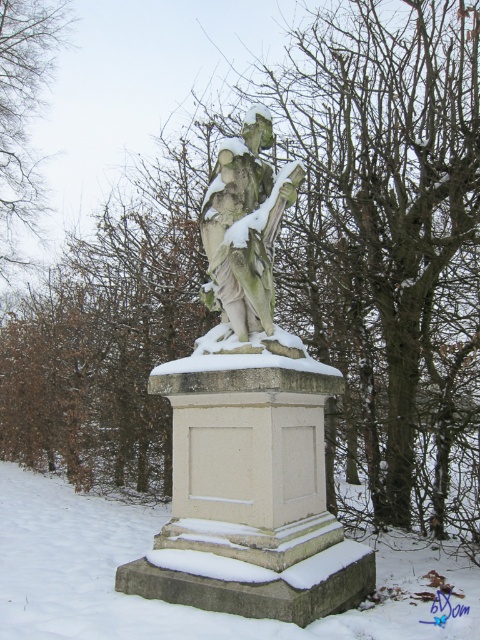
Which is more to the right, white frosty snow at base or stone statue at center?

stone statue at center is more to the right.

Which of these two, white frosty snow at base or stone statue at center, stands shorter?

white frosty snow at base is shorter.

I want to click on white frosty snow at base, so click(160, 600).

This screenshot has height=640, width=480. I want to click on white frosty snow at base, so click(x=160, y=600).

Who is shorter, white frosty snow at base or brown leafless tree at upper left?

white frosty snow at base

At what (x,y) coordinates should I click in order to perform the action: click on white frosty snow at base. Please return your answer as a coordinate pair (x, y). The height and width of the screenshot is (640, 480). Looking at the image, I should click on (160, 600).

Who is positioned more to the left, stone statue at center or brown leafless tree at upper left?

Positioned to the left is brown leafless tree at upper left.

How far apart are stone statue at center and brown leafless tree at upper left?

stone statue at center is 8.16 meters away from brown leafless tree at upper left.

Between point (286, 176) and point (1, 132), which one is positioned in front?

Positioned in front is point (286, 176).

Locate an element on the screen. This screenshot has height=640, width=480. stone statue at center is located at coordinates (244, 225).